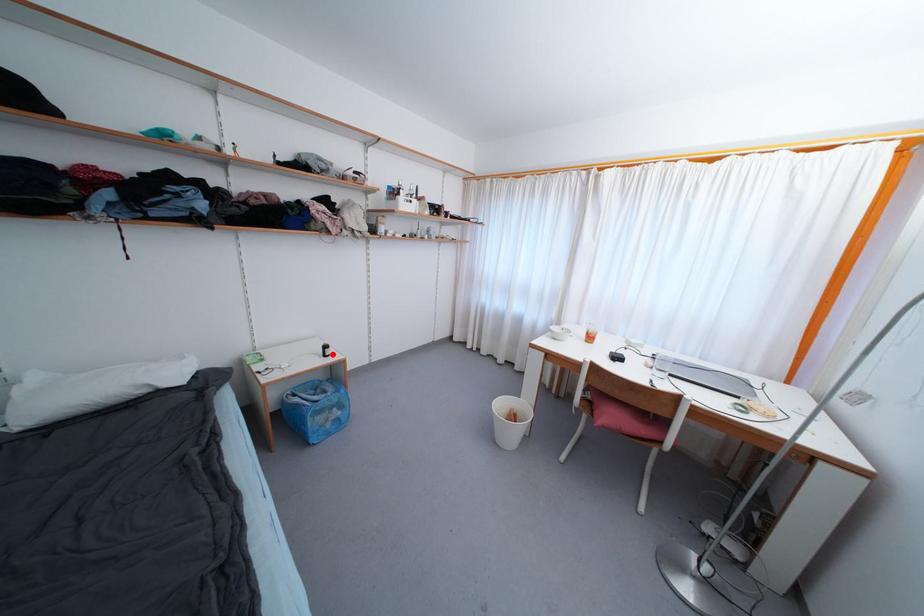
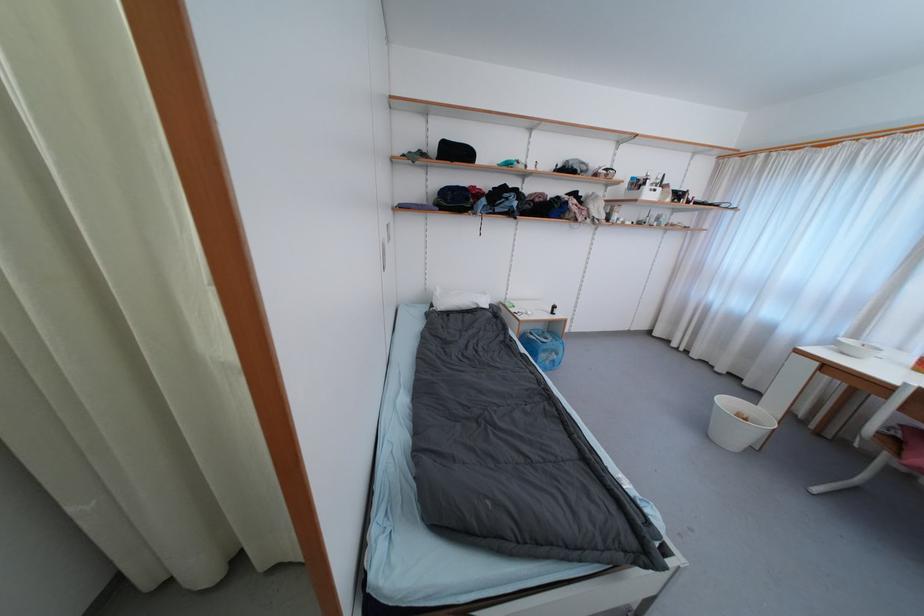
Question: I am providing you with two images of the same scene from different viewpoints. In image1, a red point is highlighted. Considering the same 3D point in image2, which of the following is correct?

Choices:
 (A) It is closer
 (B) It is farther

Answer: (B)